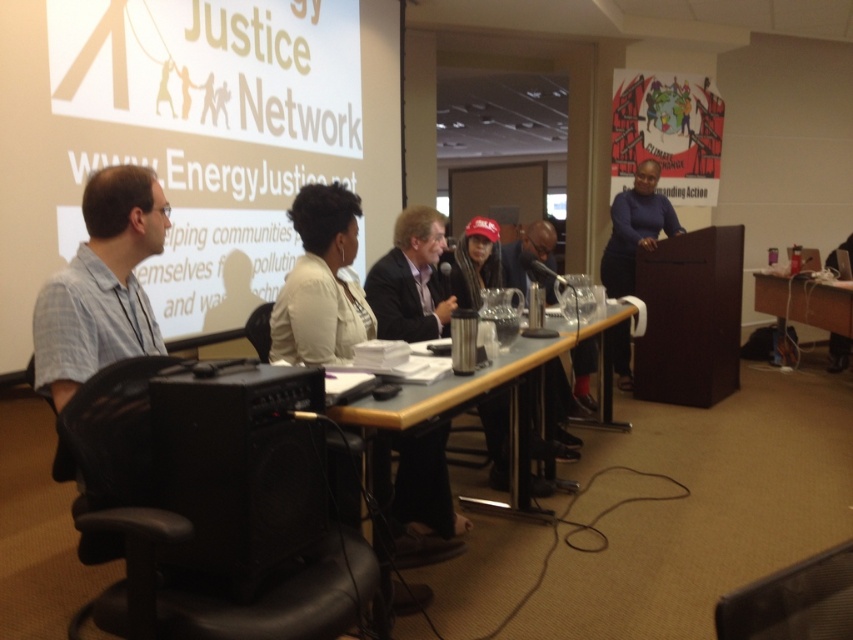
Who is shorter, matte black suit at center or wooden table at center?

Standing shorter between the two is matte black suit at center.

Does matte black suit at center appear on the right side of wooden table at center?

In fact, matte black suit at center is to the left of wooden table at center.

Between point (396, 253) and point (433, 392), which one is positioned in front?

Point (433, 392) is in front.

Locate an element on the screen. matte black suit at center is located at coordinates (410, 280).

Between white fabric jacket at center and dark blue sweater at center, which one appears on the right side from the viewer's perspective?

dark blue sweater at center is more to the right.

Can you confirm if white fabric jacket at center is bigger than dark blue sweater at center?

Incorrect, white fabric jacket at center is not larger than dark blue sweater at center.

Who is more forward, (416, 504) or (614, 280)?

Positioned in front is point (416, 504).

The width and height of the screenshot is (853, 640). What are the coordinates of `white fabric jacket at center` in the screenshot? It's located at (322, 282).

Where is `black leather swivel chair at lower left`? The width and height of the screenshot is (853, 640). black leather swivel chair at lower left is located at coordinates (215, 502).

Can you confirm if black leather swivel chair at lower left is shorter than dark blue sweater at center?

Yes, black leather swivel chair at lower left is shorter than dark blue sweater at center.

The height and width of the screenshot is (640, 853). What are the coordinates of `black leather swivel chair at lower left` in the screenshot? It's located at (215, 502).

Where is `black leather swivel chair at lower left`? The height and width of the screenshot is (640, 853). black leather swivel chair at lower left is located at coordinates (215, 502).